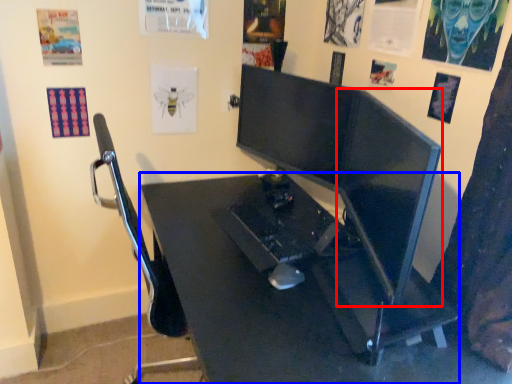
Question: Which object appears farthest to the camera in this image, computer monitor (highlighted by a red box) or desk (highlighted by a blue box)?

Choices:
 (A) computer monitor
 (B) desk

Answer: (A)